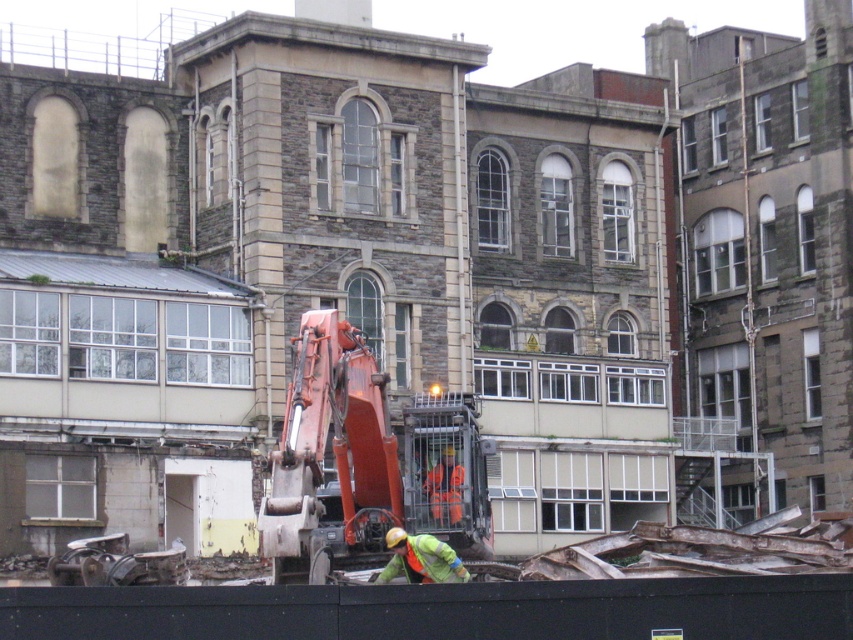
Based on the photo, you are standing at the construction site and want to know how far the point marked at coordinates (390,532) is from you. Can you determine the distance?

The point marked at coordinates (390,532) is 43.88 meters away from you.

You are a safety inspector at the construction site. You need to ensure that the orange metallic excavator at center and the green reflective jacket at center are positioned safely. Given that the excavator is wider than the worker, what should you check first to ensure the worker is not in the excavator swing radius?

The orange metallic excavator at center has a larger width than the green reflective jacket at center, so you should check if the green reflective jacket at center is within the excavator swing radius to ensure the worker is safe from potential swinging movements.